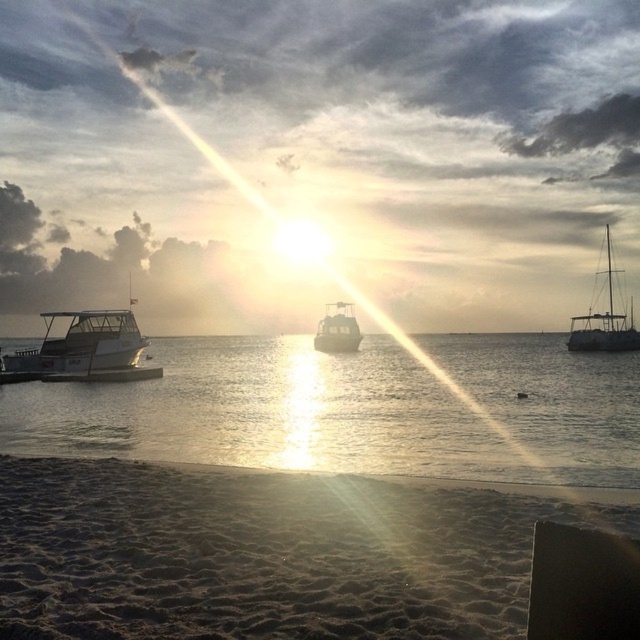
Question: Among these objects, which one is farthest from the camera?

Choices:
 (A) metallic silver boat at center
 (B) satin white sailboat at right

Answer: (A)

Question: Which of the following is the farthest from the observer?

Choices:
 (A) metallic silver boat at center
 (B) sandy beach at lower left

Answer: (A)

Question: Is clear water at lower left positioned behind metallic silver boat at center?

Choices:
 (A) no
 (B) yes

Answer: (A)

Question: Where is clear water at lower left located in relation to metallic silver boat at left in the image?

Choices:
 (A) above
 (B) below

Answer: (B)

Question: Which object is closer to the camera taking this photo?

Choices:
 (A) sandy beach at lower left
 (B) metallic silver boat at left
 (C) satin white sailboat at right
 (D) clear water at lower left

Answer: (A)

Question: Can you confirm if sandy beach at lower left is positioned to the left of metallic silver boat at left?

Choices:
 (A) yes
 (B) no

Answer: (B)